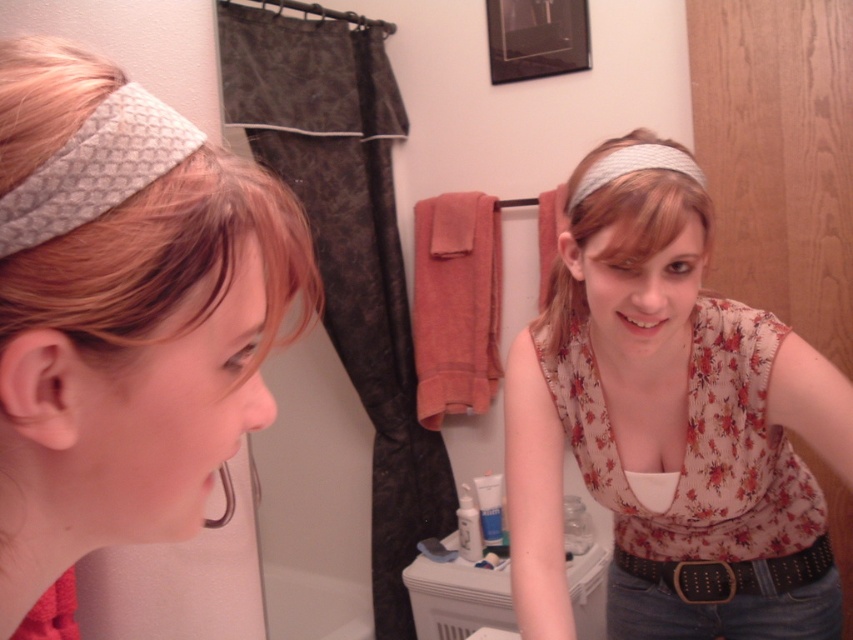
Consider the image. Which is below, matte gray headband at upper left or black leather belt at lower right?

black leather belt at lower right

Who is positioned more to the left, matte gray headband at upper left or black leather belt at lower right?

matte gray headband at upper left

Where is `matte gray headband at upper left`? Image resolution: width=853 pixels, height=640 pixels. matte gray headband at upper left is located at coordinates (138, 362).

Locate an element on the screen. This screenshot has width=853, height=640. matte gray headband at upper left is located at coordinates (138, 362).

Does floral fabric top at center have a greater width compared to matte gray headband at upper left?

Correct, the width of floral fabric top at center exceeds that of matte gray headband at upper left.

Does point (705, 561) lie behind point (270, 182)?

Yes, it is behind point (270, 182).

Is point (604, 212) farther from viewer compared to point (251, 202)?

Yes, point (604, 212) is behind point (251, 202).

Where is `floral fabric top at center`? floral fabric top at center is located at coordinates (668, 422).

Between floral fabric top at center and white textured headband at center, which one appears on the right side from the viewer's perspective?

Positioned to the right is floral fabric top at center.

Between point (717, 602) and point (578, 216), which one is positioned in front?

Point (578, 216)

This screenshot has width=853, height=640. Identify the location of floral fabric top at center. point(668,422).

This screenshot has width=853, height=640. I want to click on floral fabric top at center, so click(668, 422).